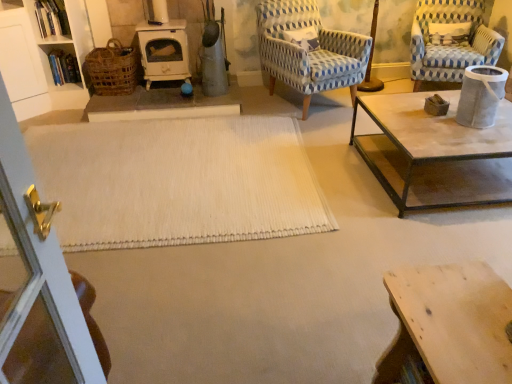
Question: From a real-world perspective, is white woven rug at center physically located above or below woven brown basket at left?

Choices:
 (A) above
 (B) below

Answer: (B)

Question: Is white woven rug at center wider or thinner than woven brown basket at left?

Choices:
 (A) thin
 (B) wide

Answer: (B)

Question: Estimate the real-world distances between objects in this image. Which object is closer to the wooden table at lower right?

Choices:
 (A) blue and white checkered fabric armchair at upper right, which is the 2th chair from left to right
 (B) woven brown basket at left
 (C) white woven rug at center
 (D) blue woven fabric chair at upper right, which appears as the first chair when viewed from the left

Answer: (C)

Question: Which of these objects is positioned closest to the wooden table at lower right?

Choices:
 (A) woven brown basket at left
 (B) blue woven fabric chair at upper right, placed as the second chair when sorted from right to left
 (C) blue and white checkered fabric armchair at upper right, which is the 2th chair from left to right
 (D) white woven rug at center

Answer: (D)